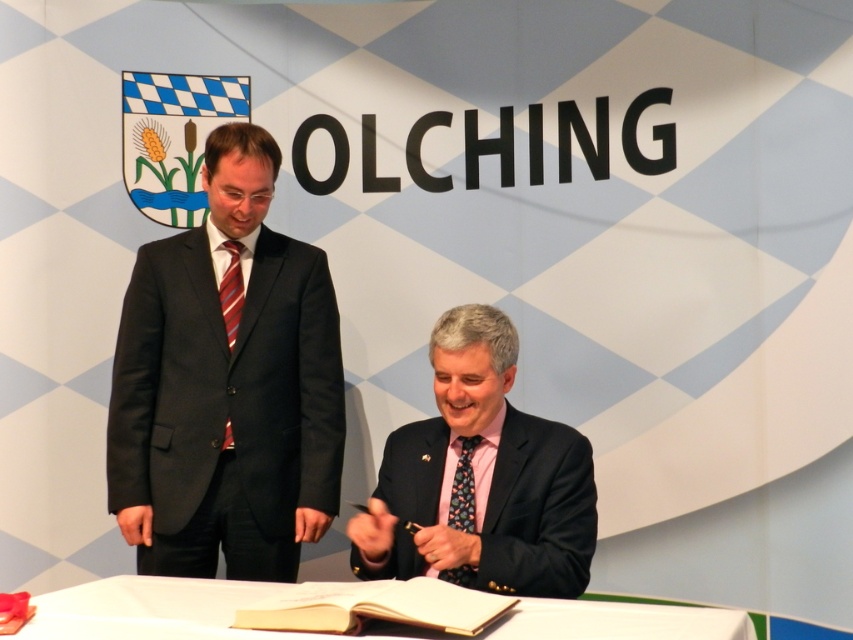
You are a photographer at a formal event. You need to capture a photo of the matte black suit at left and the floral silk tie at lower center. Based on their positions, which object is located to the right of the other?

The floral silk tie at lower center is located to the right of the matte black suit at left.

You are a photographer standing at the event. You want to capture a photo of the white paper at lower center without including the men in the frame. Given that the camera is positioned 5.86 feet away from the paper, is it possible to adjust your position to exclude the men while still keeping the paper in focus?

The white paper at lower center is 5.86 feet away from the camera. Since the men are standing at the table near the paper, moving the camera closer or farther might adjust the framing. However, maintaining focus on the paper while excluding the men depends on the camera angle and lens. If the photographer moves sideways or adjusts the lens to zoom in, it might be possible to exclude the men while keeping the paper in focus at that distance.

You are at the signing ceremony and need to place a small flower bouquet between the two points marked as point (122, 406) and point (445, 572). Since the bouquet must be placed in front of the shield emblem, will placing it between these two points work?

Point (122, 406) is behind point (445, 572). Therefore, placing the bouquet between them would position it in front of the shield emblem, so yes, it will work.